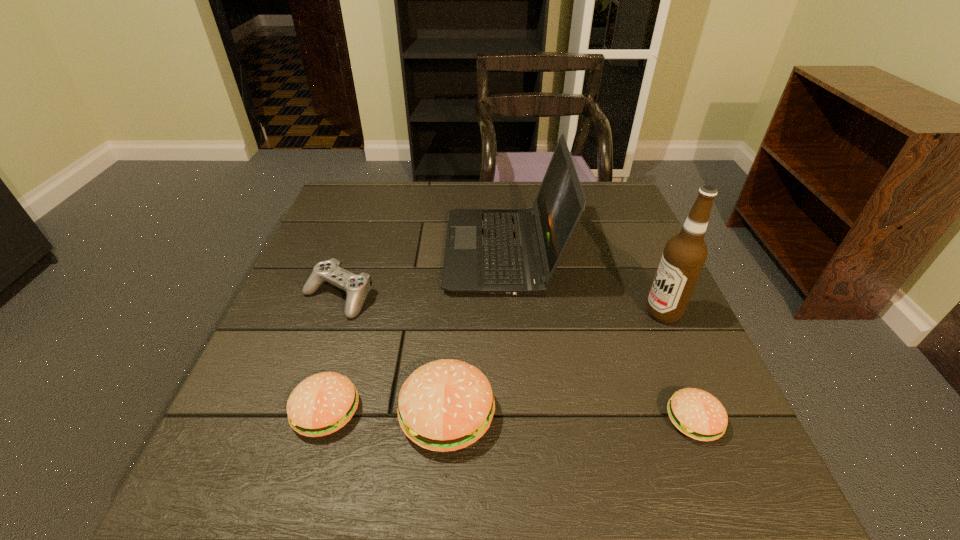
Locate an element on the screen. free spot between the second shortest patty and the control is located at coordinates (332, 354).

I want to click on object that is the third closest to the laptop_computer, so click(x=445, y=405).

Where is `object that ranks as the fifth closest to the rightmost patty`? This screenshot has width=960, height=540. object that ranks as the fifth closest to the rightmost patty is located at coordinates (356, 287).

Identify the location of patty that is the second closest one to the leftmost patty. The width and height of the screenshot is (960, 540). (696, 413).

Where is `patty that is the closest to the shortest patty`? The width and height of the screenshot is (960, 540). patty that is the closest to the shortest patty is located at coordinates (445, 405).

Locate an element on the screen. The width and height of the screenshot is (960, 540). vacant space that satisfies the following two spatial constraints: 1. on the screen of the second tallest object; 2. on the left side of the shortest patty is located at coordinates [x=515, y=420].

This screenshot has width=960, height=540. What are the coordinates of `free location that satisfies the following two spatial constraints: 1. on the front side of the control; 2. on the right side of the second shortest patty` in the screenshot? It's located at (297, 411).